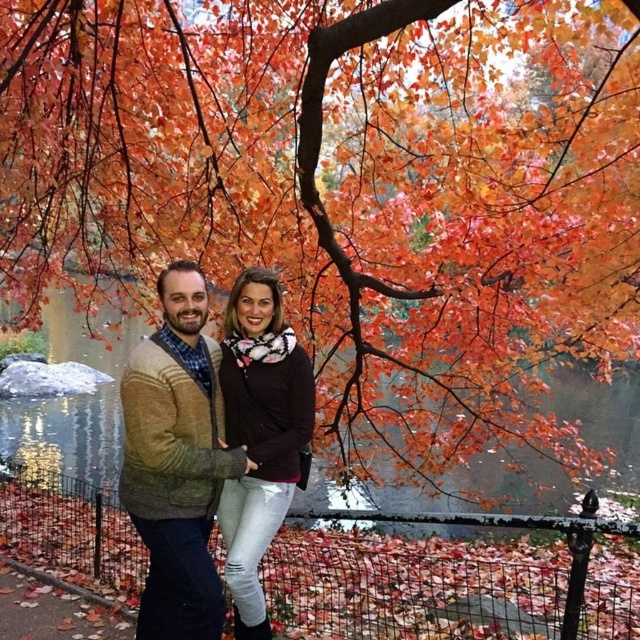
You are taking a photo of the couple wearing the knit sweater at center and the matte black sweater at center. Which sweater is positioned to the left in the image?

The knit sweater at center is positioned to the left of the matte black sweater at center in the image.

You are trying to decide which sweater to take for a walk in the autumn park. You see both the knit sweater at center and the matte black sweater at center in the image. Which one is bigger?

The knit sweater at center is larger in size compared to the matte black sweater at center, so you should choose the knit sweater at center if you prefer a bigger one.

You are trying to decide which sweater to wear for a photo shoot. Both the knit sweater at center and the matte black sweater at center are available. According to the scene, which one is visible on top?

The matte black sweater at center is visible on top because the knit sweater at center is positioned under it.